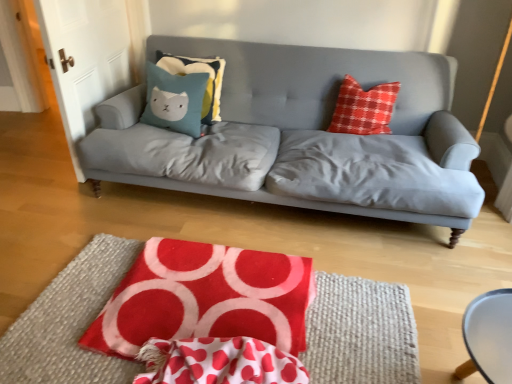
Question: Is red felt rug at center surrounding smooth white table at lower right?

Choices:
 (A) yes
 (B) no

Answer: (B)

Question: Does red felt rug at center have a larger size compared to smooth white table at lower right?

Choices:
 (A) no
 (B) yes

Answer: (B)

Question: Considering the relative sizes of red felt rug at center and smooth white table at lower right in the image provided, is red felt rug at center thinner than smooth white table at lower right?

Choices:
 (A) yes
 (B) no

Answer: (B)

Question: From a real-world perspective, is red felt rug at center located beneath smooth white table at lower right?

Choices:
 (A) no
 (B) yes

Answer: (B)

Question: Does red felt rug at center have a greater width compared to smooth white table at lower right?

Choices:
 (A) yes
 (B) no

Answer: (A)

Question: In the image, is teal plush pillow at center-left, acting as the 1th pillow starting from the front, positioned in front of or behind teal fabric pillow with cat design at center, which appears as the 1th pillow when viewed from the back?

Choices:
 (A) front
 (B) behind

Answer: (A)

Question: Is teal plush pillow at center-left, the 2th pillow from the back, situated inside teal fabric pillow with cat design at center, placed as the second pillow when sorted from front to back, or outside?

Choices:
 (A) inside
 (B) outside

Answer: (B)

Question: In terms of width, does teal plush pillow at center-left, the 2th pillow from the back, look wider or thinner when compared to teal fabric pillow with cat design at center, placed as the second pillow when sorted from front to back?

Choices:
 (A) wide
 (B) thin

Answer: (A)

Question: From a real-world perspective, is teal plush pillow at center-left, the 2th pillow from the back, above or below teal fabric pillow with cat design at center, which appears as the 1th pillow when viewed from the back?

Choices:
 (A) below
 (B) above

Answer: (A)

Question: Is teal fabric pillow with cat design at center, placed as the second pillow when sorted from front to back, taller or shorter than red polka dot fabric at center?

Choices:
 (A) tall
 (B) short

Answer: (A)

Question: In terms of width, does teal fabric pillow with cat design at center, which appears as the 1th pillow when viewed from the back, look wider or thinner when compared to red polka dot fabric at center?

Choices:
 (A) thin
 (B) wide

Answer: (B)

Question: Looking at the image, does teal fabric pillow with cat design at center, placed as the second pillow when sorted from front to back, seem bigger or smaller compared to red polka dot fabric at center?

Choices:
 (A) small
 (B) big

Answer: (B)

Question: Would you say teal fabric pillow with cat design at center, placed as the second pillow when sorted from front to back, is inside or outside red polka dot fabric at center?

Choices:
 (A) outside
 (B) inside

Answer: (A)

Question: From a real-world perspective, relative to red velvety quilt at lower center, is teal fabric pillow with cat design at center, which appears as the 1th pillow when viewed from the back, vertically above or below?

Choices:
 (A) below
 (B) above

Answer: (B)

Question: Is teal fabric pillow with cat design at center, which appears as the 1th pillow when viewed from the back, to the left or to the right of red velvety quilt at lower center in the image?

Choices:
 (A) left
 (B) right

Answer: (A)